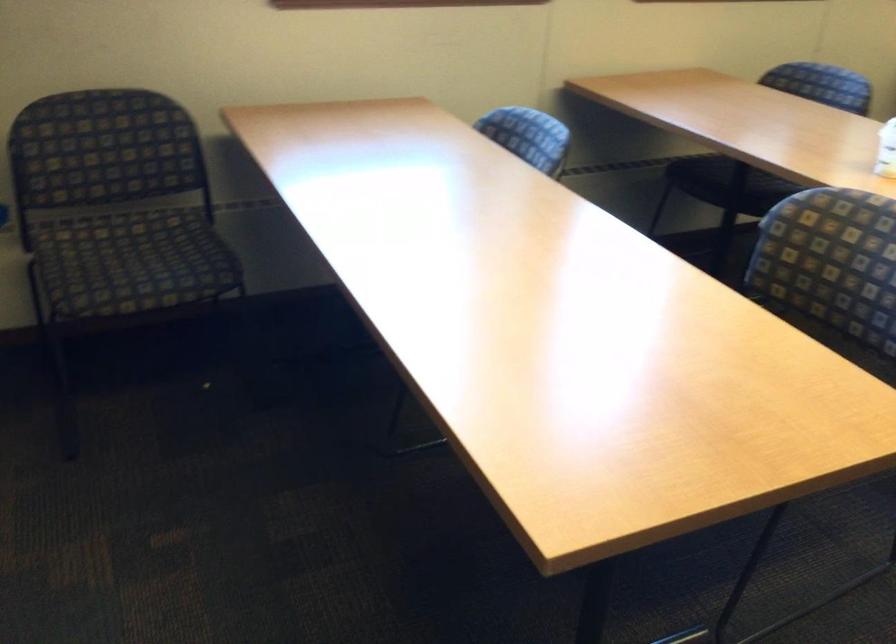
The image size is (896, 644). Find the location of `white plastic bottle`. white plastic bottle is located at coordinates 885,149.